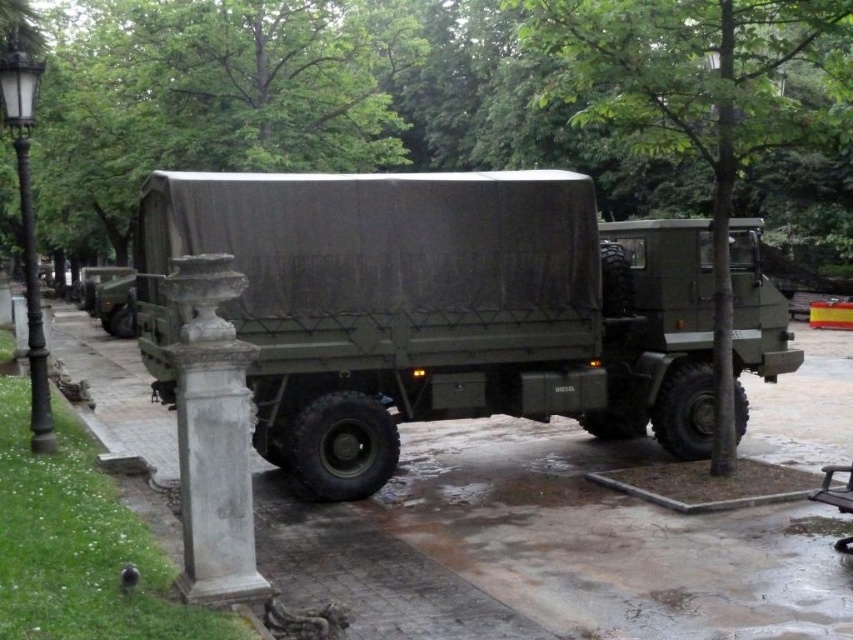
Question: Among these objects, which one is nearest to the camera?

Choices:
 (A) white stone column at lower left
 (B) matte green truck at center

Answer: (A)

Question: Which of the following is the farthest from the observer?

Choices:
 (A) (593, 269)
 (B) (241, 589)

Answer: (A)

Question: From the image, what is the correct spatial relationship of matte green truck at center in relation to white stone column at lower left?

Choices:
 (A) above
 (B) below

Answer: (A)

Question: Which of the following is the closest to the observer?

Choices:
 (A) white stone column at lower left
 (B) matte green truck at center

Answer: (A)

Question: Does matte green truck at center appear on the left side of white stone column at lower left?

Choices:
 (A) no
 (B) yes

Answer: (B)

Question: Can you confirm if matte green truck at center is thinner than white stone column at lower left?

Choices:
 (A) yes
 (B) no

Answer: (A)